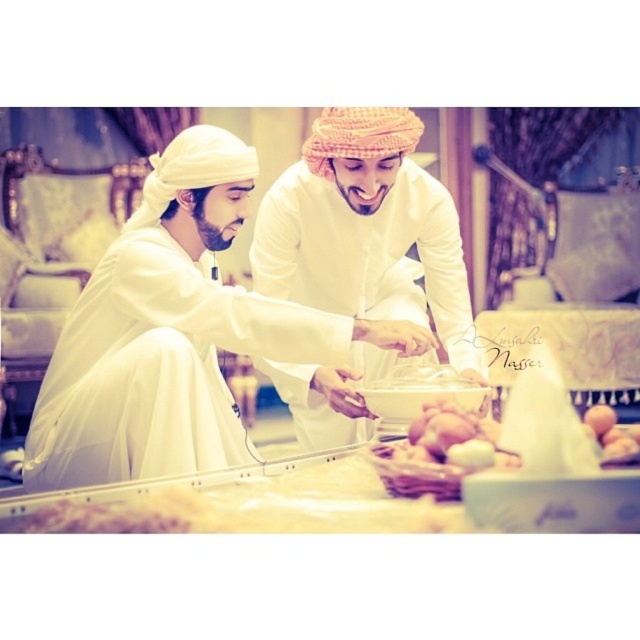
Does point (413, 456) lie in front of point (611, 451)?

No, it is behind (611, 451).

Can you confirm if smooth white eggs at center is thinner than smooth white bread at lower right?

No.

This screenshot has height=640, width=640. Identify the location of smooth white eggs at center. (445, 433).

Identify the location of smooth white eggs at center. (445, 433).

Where is `white matte clothing at center`? The height and width of the screenshot is (640, 640). white matte clothing at center is located at coordinates (177, 333).

Is white matte clothing at center bigger than smooth white bread at lower right?

Yes.

Does point (225, 314) come in front of point (632, 435)?

No, it is not.

At what (x,y) coordinates should I click in order to perform the action: click on white matte clothing at center. Please return your answer as a coordinate pair (x, y). Image resolution: width=640 pixels, height=640 pixels. Looking at the image, I should click on (177, 333).

Is white matte clothing at center above white matte/soft fabric at center?

No, white matte clothing at center is not above white matte/soft fabric at center.

Who is positioned more to the left, white matte clothing at center or white matte/soft fabric at center?

From the viewer's perspective, white matte clothing at center appears more on the left side.

Is point (132, 264) in front of point (312, 212)?

Yes.

Locate an element on the screen. This screenshot has height=640, width=640. white matte clothing at center is located at coordinates (177, 333).